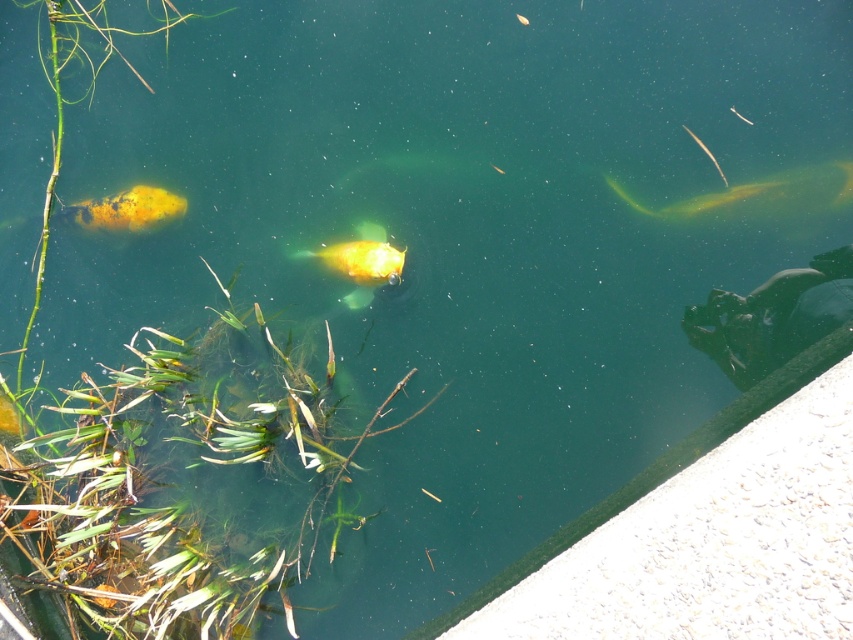
Who is higher up, shiny orange fish at left or shiny gold fish at center?

shiny orange fish at left is higher up.

Can you confirm if shiny orange fish at left is positioned below shiny gold fish at center?

Actually, shiny orange fish at left is above shiny gold fish at center.

What do you see at coordinates (126, 209) in the screenshot?
I see `shiny orange fish at left` at bounding box center [126, 209].

The image size is (853, 640). In order to click on shiny orange fish at left in this screenshot , I will do `click(126, 209)`.

Is point (611, 180) less distant than point (379, 264)?

Yes.

Between point (613, 188) and point (363, 275), which one is positioned in front?

Point (613, 188)

Where is `translucent yellowish-green fish at upper right`? This screenshot has width=853, height=640. translucent yellowish-green fish at upper right is located at coordinates (762, 195).

Could you measure the distance between translucent yellowish-green fish at upper right and translucent yellow fish at upper right?

The distance of translucent yellowish-green fish at upper right from translucent yellow fish at upper right is 19.73 centimeters.

Based on the photo, does translucent yellowish-green fish at upper right appear on the left side of translucent yellow fish at upper right?

In fact, translucent yellowish-green fish at upper right is to the right of translucent yellow fish at upper right.

Who is more distant from viewer, (747, 182) or (695, 136)?

The point (695, 136) is behind.

Where is `translucent yellowish-green fish at upper right`? This screenshot has height=640, width=853. translucent yellowish-green fish at upper right is located at coordinates (762, 195).